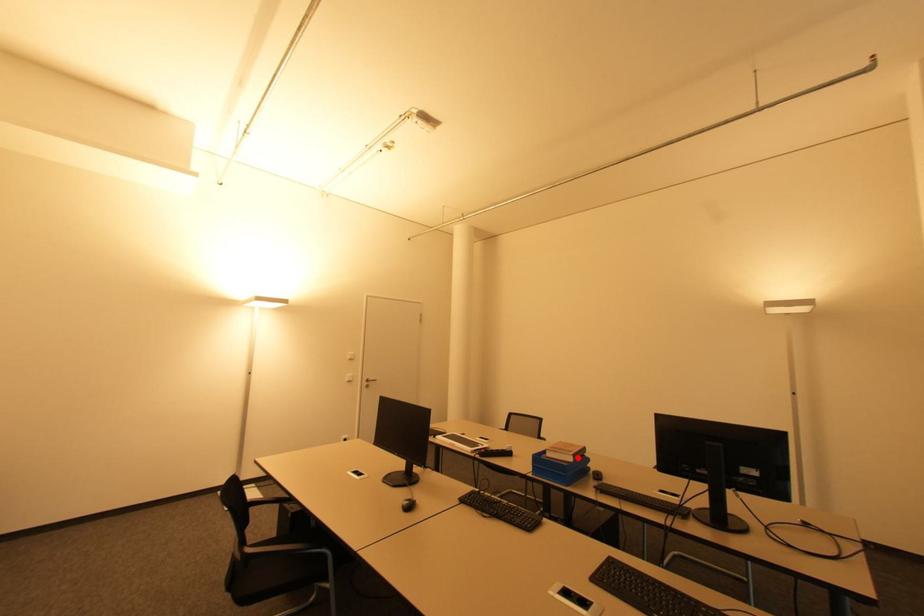
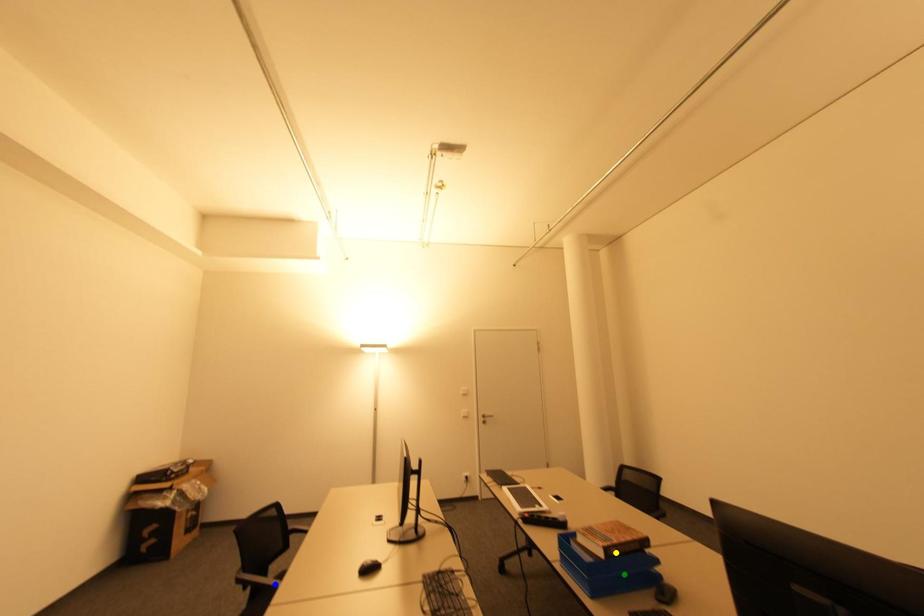
Question: I am providing you with two images of the same scene from different viewpoints. A red point is marked on the first image. You are given multiple points on the second image. Which point in image 2 represents the same 3d spot as the red point in image 1?

Choices:
 (A) yellow point
 (B) green point
 (C) blue point

Answer: (A)